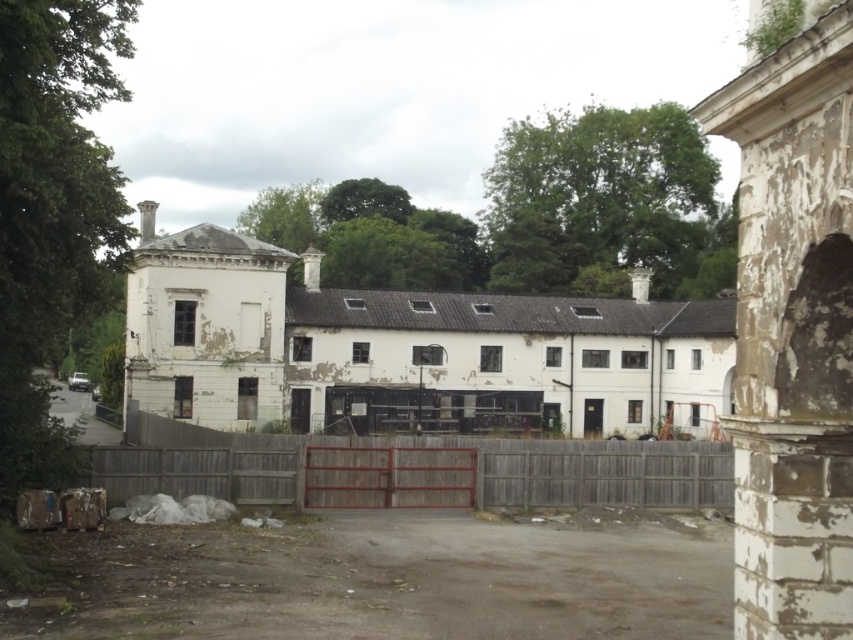
Question: Does wooden gate at center appear on the right side of white peeling plaster archway at right?

Choices:
 (A) yes
 (B) no

Answer: (B)

Question: Which object is closer to the camera taking this photo?

Choices:
 (A) wooden gate at center
 (B) white peeling plaster archway at right

Answer: (B)

Question: Does wooden gate at center have a lesser width compared to white peeling plaster archway at right?

Choices:
 (A) no
 (B) yes

Answer: (A)

Question: Does wooden gate at center have a lesser width compared to white peeling plaster archway at right?

Choices:
 (A) no
 (B) yes

Answer: (A)

Question: Which object is closer to the camera taking this photo?

Choices:
 (A) wooden gate at center
 (B) white peeling plaster archway at right

Answer: (B)

Question: Which object is farther from the camera taking this photo?

Choices:
 (A) white peeling plaster archway at right
 (B) wooden gate at center

Answer: (B)